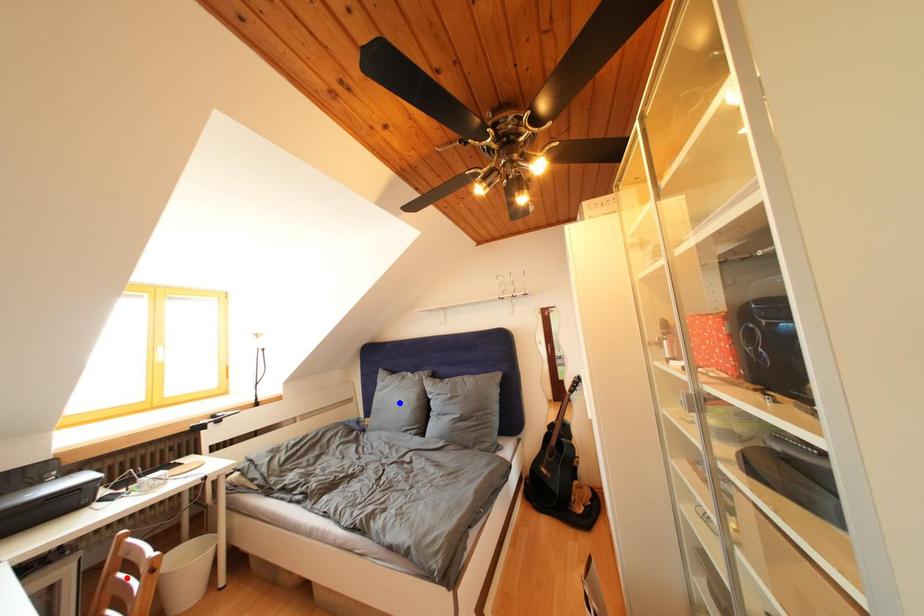
Question: In the image, two points are highlighted. Which point is nearer to the camera? Reply with the corresponding letter.

Choices:
 (A) blue point
 (B) red point

Answer: (B)